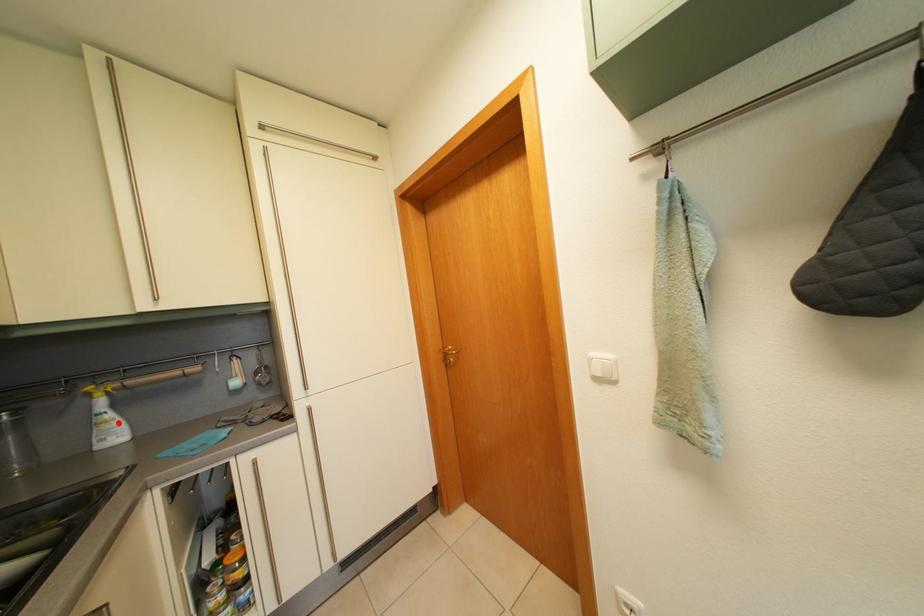
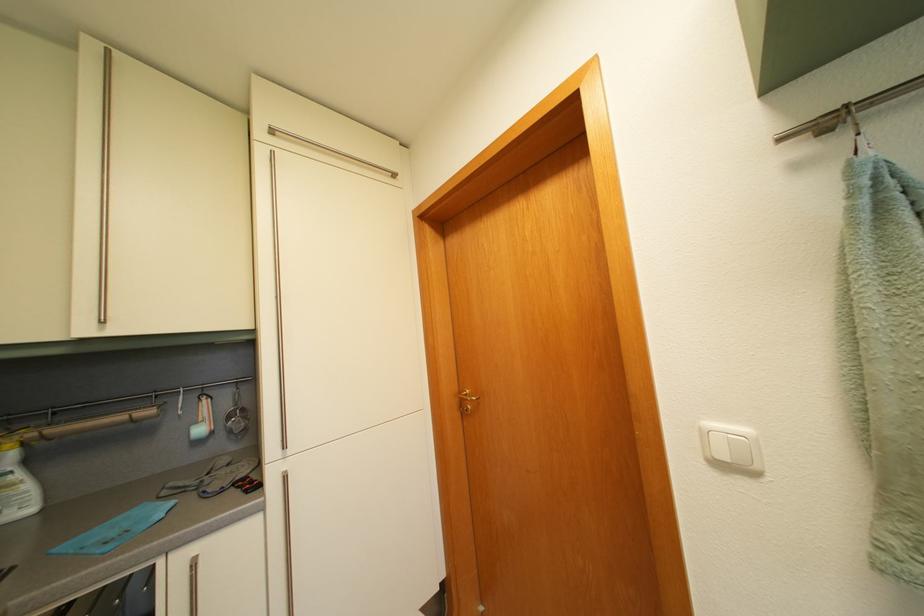
Where in the second image is the point corresponding to the highlighted location from the first image?

(26, 484)